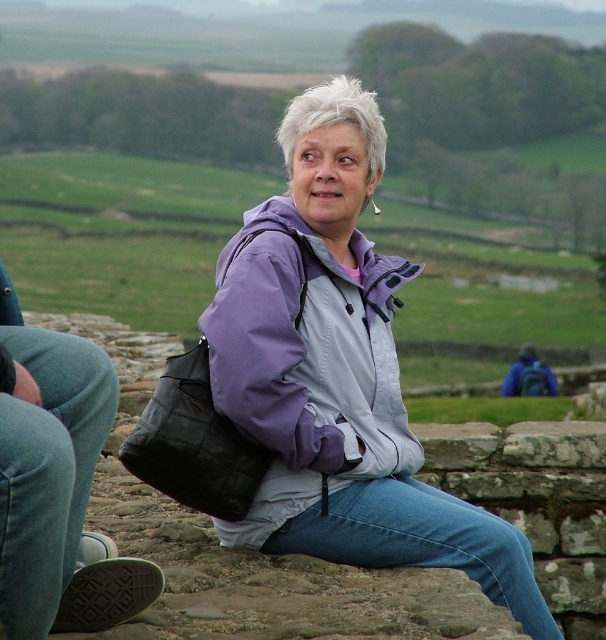
Question: Is purple matte jacket at center bigger than purple softshell jacket at center?

Choices:
 (A) no
 (B) yes

Answer: (B)

Question: Is purple matte jacket at center further to the viewer compared to purple softshell jacket at center?

Choices:
 (A) no
 (B) yes

Answer: (B)

Question: Can you confirm if purple matte jacket at center is positioned to the right of purple softshell jacket at center?

Choices:
 (A) yes
 (B) no

Answer: (A)

Question: Which object is closer to the camera taking this photo?

Choices:
 (A) purple matte jacket at center
 (B) purple softshell jacket at center

Answer: (B)

Question: Which point is closer to the camera taking this photo?

Choices:
 (A) (275, 467)
 (B) (290, 516)

Answer: (B)